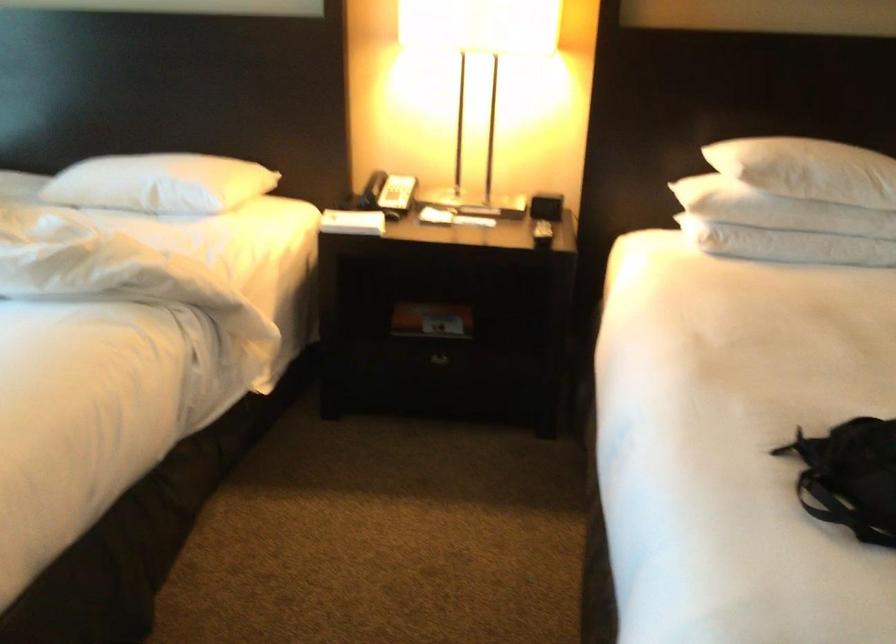
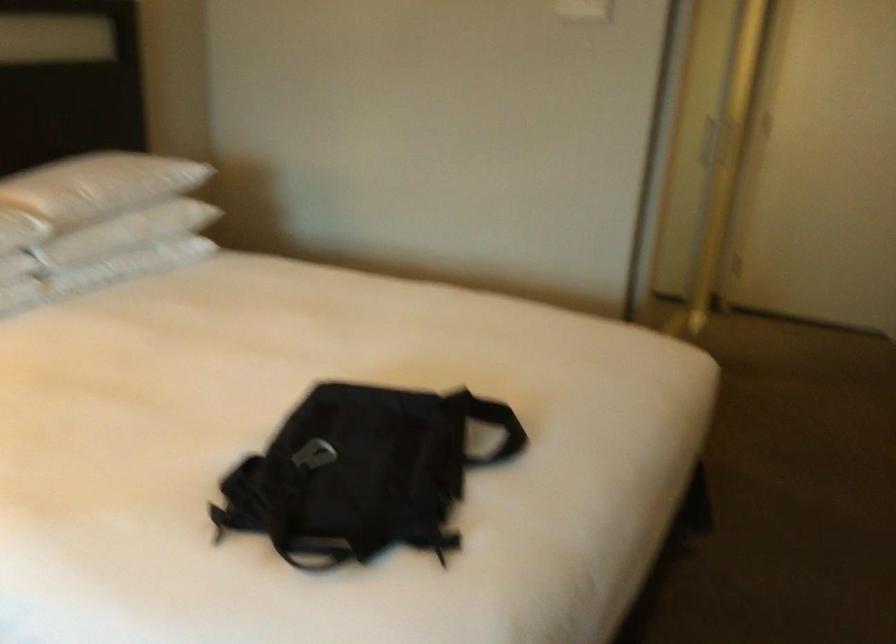
Question: The camera is either moving clockwise (left) or counter-clockwise (right) around the object. The first image is from the beginning of the video and the second image is from the end. Is the camera moving left or right when shooting the video?

Choices:
 (A) Left
 (B) Right

Answer: (A)